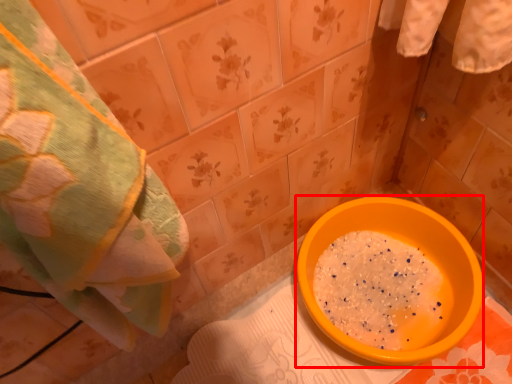
Question: Where is basin (annotated by the red box) located in relation to towel in the image?

Choices:
 (A) left
 (B) right

Answer: (B)